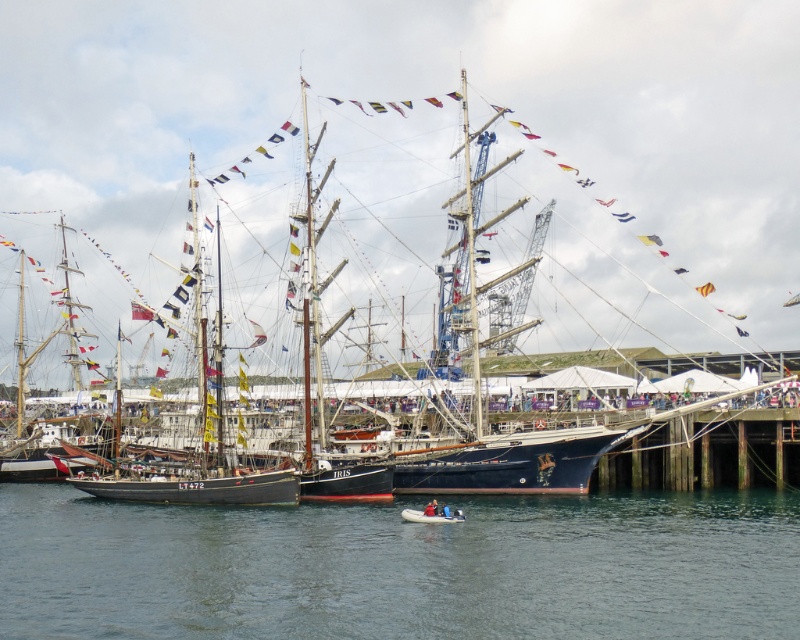
This screenshot has width=800, height=640. I want to click on dark blue wooden ship at center, so click(x=652, y=228).

This screenshot has height=640, width=800. What do you see at coordinates (652, 228) in the screenshot? I see `dark blue wooden ship at center` at bounding box center [652, 228].

Is point (616, 349) positioned in front of point (648, 609)?

No, it is not.

Identify the location of dark blue wooden ship at center. 652,228.

Can you confirm if dark blue wooden ship at center is smaller than rubber dinghy at lower center?

No.

Between dark blue wooden ship at center and rubber dinghy at lower center, which one has more height?

dark blue wooden ship at center is taller.

The image size is (800, 640). Describe the element at coordinates (652, 228) in the screenshot. I see `dark blue wooden ship at center` at that location.

Identify the location of dark blue wooden ship at center. The width and height of the screenshot is (800, 640). (652, 228).

Can you confirm if clear blue water at center is wider than rubber dinghy at lower center?

Indeed, clear blue water at center has a greater width compared to rubber dinghy at lower center.

Which is above, clear blue water at center or rubber dinghy at lower center?

rubber dinghy at lower center is higher up.

Does point (590, 573) come closer to viewer compared to point (462, 518)?

Yes, it is in front of point (462, 518).

At what (x,y) coordinates should I click in order to perform the action: click on clear blue water at center. Please return your answer as a coordinate pair (x, y). This screenshot has height=640, width=800. Looking at the image, I should click on (401, 566).